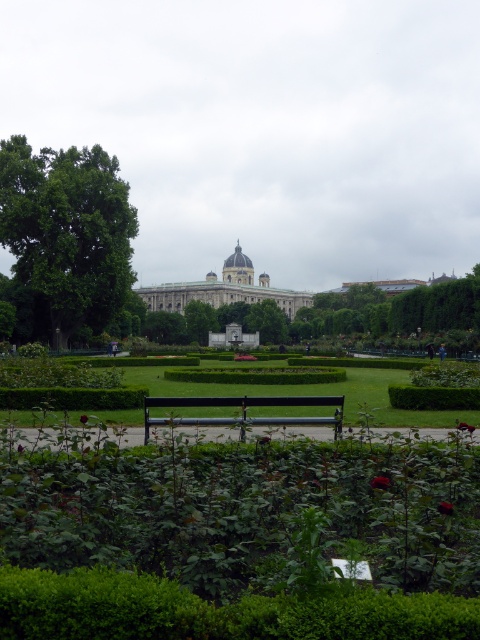
Question: Is green leafy tree at left further to the viewer compared to green leafy hedge at center?

Choices:
 (A) yes
 (B) no

Answer: (A)

Question: Which is nearer to the green matte bench at center?

Choices:
 (A) green leafy hedge at center
 (B) white stone building at center

Answer: (A)

Question: Is green matte bench at center positioned behind green leafy tree at left?

Choices:
 (A) yes
 (B) no

Answer: (B)

Question: Which is farther from the green leafy hedge at center?

Choices:
 (A) green matte bench at center
 (B) black metal bench at center
 (C) green leafy tree at left
 (D) white stone building at center

Answer: (D)

Question: Can you confirm if green matte bench at center is positioned to the right of green leafy hedge at center?

Choices:
 (A) no
 (B) yes

Answer: (A)

Question: Considering the real-world distances, which object is farthest from the green leafy tree at left?

Choices:
 (A) white stone building at center
 (B) green matte bench at center
 (C) green leafy hedge at center
 (D) black metal bench at center

Answer: (A)